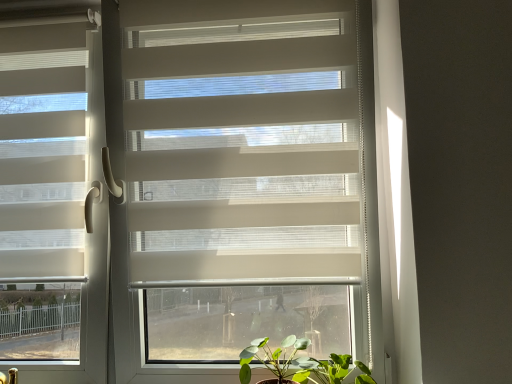
Question: Should I look upward or downward to see matte white blinds at left?

Choices:
 (A) down
 (B) up

Answer: (B)

Question: Is green leafy plant at lower center beside green matte plant at lower center?

Choices:
 (A) yes
 (B) no

Answer: (A)

Question: From a real-world perspective, is green leafy plant at lower center on green matte plant at lower center?

Choices:
 (A) no
 (B) yes

Answer: (A)

Question: Is green leafy plant at lower center bigger than green matte plant at lower center?

Choices:
 (A) yes
 (B) no

Answer: (A)

Question: Is green leafy plant at lower center closer to camera compared to green matte plant at lower center?

Choices:
 (A) no
 (B) yes

Answer: (B)

Question: Is green leafy plant at lower center further to the viewer compared to green matte plant at lower center?

Choices:
 (A) yes
 (B) no

Answer: (B)

Question: From the image's perspective, is green leafy plant at lower center under green matte plant at lower center?

Choices:
 (A) yes
 (B) no

Answer: (A)

Question: From a real-world perspective, is matte white blinds at left positioned over green leafy plant at lower center based on gravity?

Choices:
 (A) yes
 (B) no

Answer: (A)

Question: From the image's perspective, is matte white blinds at left under green leafy plant at lower center?

Choices:
 (A) no
 (B) yes

Answer: (A)

Question: Considering the relative sizes of matte white blinds at left and green leafy plant at lower center in the image provided, is matte white blinds at left wider than green leafy plant at lower center?

Choices:
 (A) no
 (B) yes

Answer: (A)

Question: Are matte white blinds at left and green leafy plant at lower center far apart?

Choices:
 (A) yes
 (B) no

Answer: (B)

Question: Considering the relative positions of matte white blinds at left and green leafy plant at lower center in the image provided, is matte white blinds at left to the left of green leafy plant at lower center from the viewer's perspective?

Choices:
 (A) yes
 (B) no

Answer: (A)

Question: Considering the relative sizes of matte white blinds at left and green leafy plant at lower center in the image provided, is matte white blinds at left smaller than green leafy plant at lower center?

Choices:
 (A) no
 (B) yes

Answer: (A)

Question: Is green matte plant at lower center facing towards green leafy plant at lower center?

Choices:
 (A) no
 (B) yes

Answer: (A)